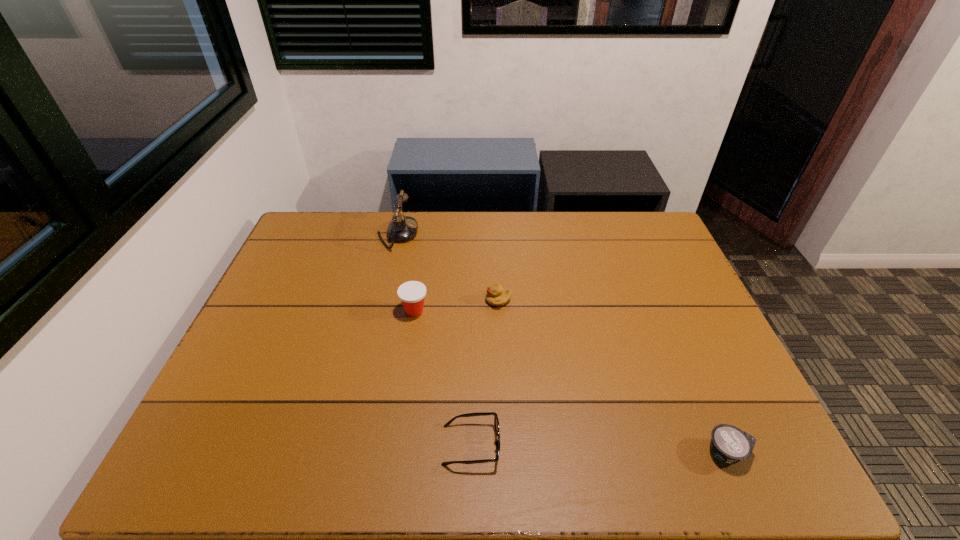
This screenshot has height=540, width=960. I want to click on free spot that satisfies the following two spatial constraints: 1. on the dial of the yogurt; 2. on the left side of the telephone, so click(347, 452).